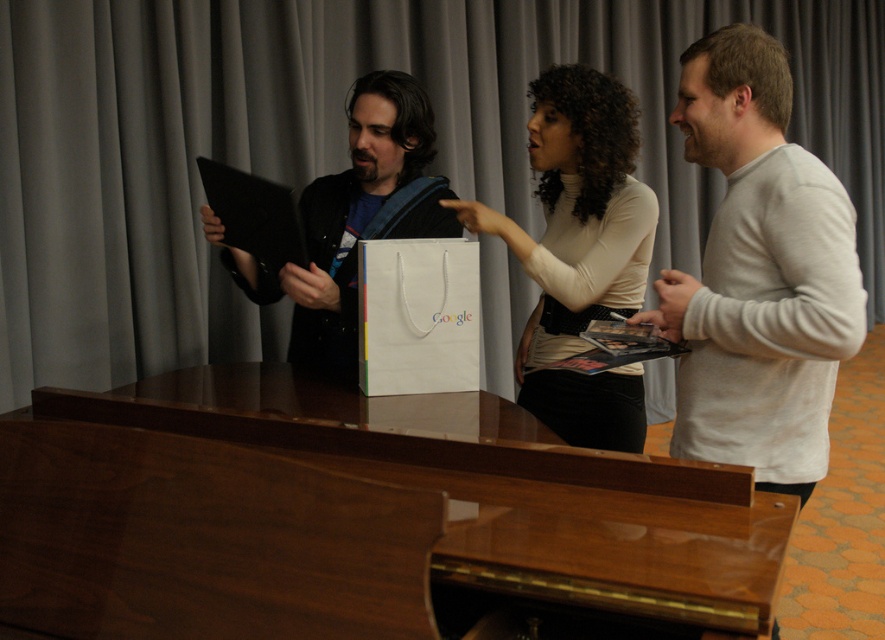
Between white cotton sweater at right and white paper bag at center, which one is positioned lower?

white paper bag at center is below.

Does white cotton sweater at right have a smaller size compared to white paper bag at center?

Incorrect, white cotton sweater at right is not smaller in size than white paper bag at center.

Who is more distant from viewer, (735, 216) or (418, 314)?

Positioned behind is point (418, 314).

Locate an element on the screen. Image resolution: width=885 pixels, height=640 pixels. white cotton sweater at right is located at coordinates (759, 273).

Is glossy wood piano at center wider than matte black tablet at center?

Yes, glossy wood piano at center is wider than matte black tablet at center.

How much distance is there between glossy wood piano at center and matte black tablet at center?

glossy wood piano at center is 18.76 inches away from matte black tablet at center.

Image resolution: width=885 pixels, height=640 pixels. Describe the element at coordinates (497, 490) in the screenshot. I see `glossy wood piano at center` at that location.

What are the coordinates of `glossy wood piano at center` in the screenshot? It's located at (497, 490).

Between point (195, 77) and point (329, 195), which one is positioned behind?

Positioned behind is point (195, 77).

In the scene shown: Who is more distant from viewer, (41, 145) or (229, 236)?

Positioned behind is point (41, 145).

Find the location of `gray fabric curtain at upper center`. gray fabric curtain at upper center is located at coordinates (335, 144).